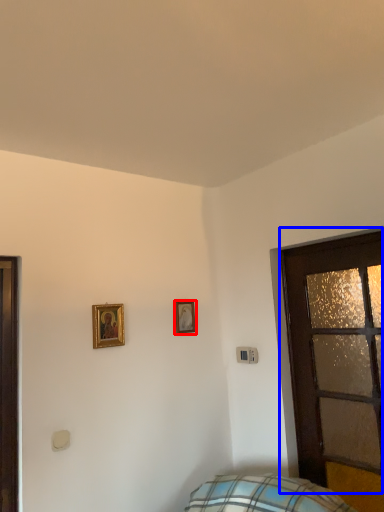
Question: Which object is further to the camera taking this photo, picture frame (highlighted by a red box) or door (highlighted by a blue box)?

Choices:
 (A) picture frame
 (B) door

Answer: (A)